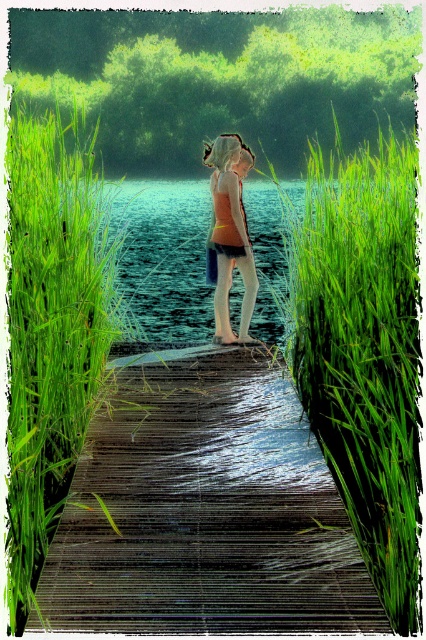
You are standing on the wooden dock and want to place a small potted plant between the green leafy grass at center and the matte orange tank top at center. Based on their positions, which object should the plant be closer to?

The plant should be placed closer to the matte orange tank top at center because the green leafy grass at center is located to the right of the matte orange tank top at center, so placing it between them would require positioning it nearer to the tank top to maintain the spatial relationship.

You are trying to determine if the green leafy grass at center can cover the matte orange tank top at center if placed directly over it. Based on their sizes, what would you conclude?

The green leafy grass at center is wider than the matte orange tank top at center, so it could potentially cover the matte orange tank top at center if positioned directly over it.

You are standing on the wooden dock at center and want to walk towards the green grass at left. Which direction should you face to move towards it?

You should face to the left to move towards the green grass at left since the wooden dock at center is to the right of green grass at left.